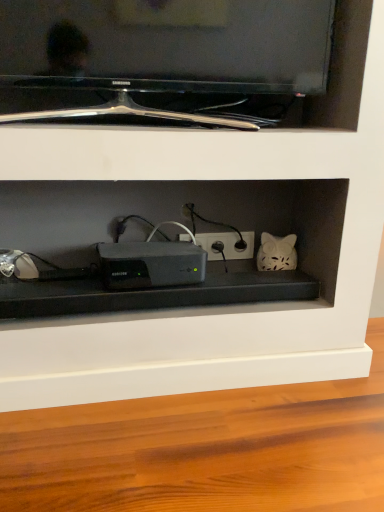
At what (x,y) coordinates should I click in order to perform the action: click on vacant space underneath black glossy tv at upper center (from a real-world perspective). Please return your answer as a coordinate pair (x, y). This screenshot has width=384, height=512. Looking at the image, I should click on (165, 124).